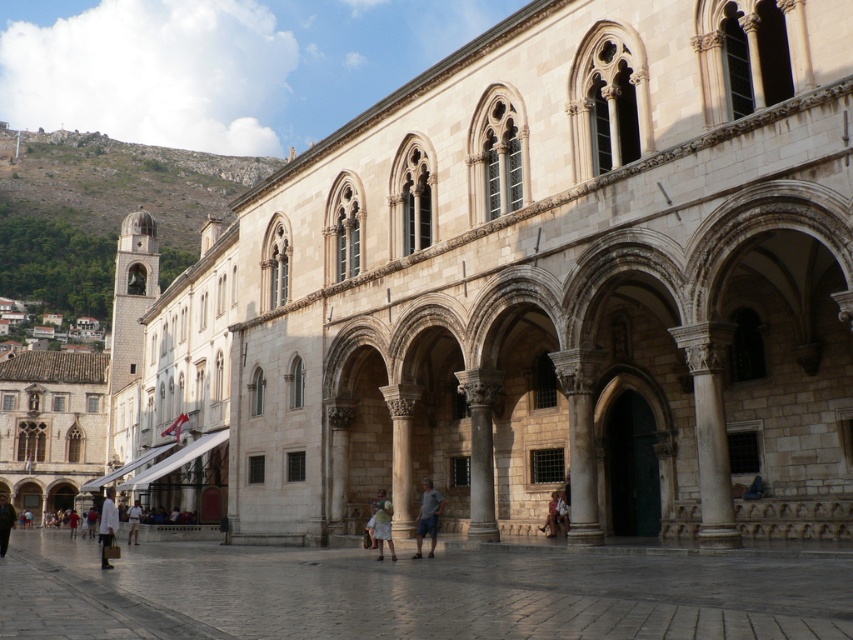
Which is in front, point (577, 486) or point (10, 520)?

Point (577, 486) is in front.

Between point (567, 401) and point (3, 540), which one is positioned in front?

Point (567, 401) is more forward.

Locate an element on the screen. This screenshot has width=853, height=640. white stone column at center is located at coordinates (579, 440).

Who is higher up, smooth stone column at center or light blue denim shorts at center?

Positioned higher is smooth stone column at center.

Between point (474, 499) and point (428, 532), which one is positioned in front?

Point (428, 532) is in front.

Locate an element on the screen. This screenshot has width=853, height=640. smooth stone column at center is located at coordinates (480, 449).

Where is `smooth stone column at center`? This screenshot has height=640, width=853. smooth stone column at center is located at coordinates click(x=480, y=449).

Does smooth stone courtyard at center have a greater width compared to light beige fabric bag at center?

Yes.

Who is taller, smooth stone courtyard at center or light beige fabric bag at center?

smooth stone courtyard at center is taller.

Is point (846, 618) positioned in front of point (374, 529)?

Yes, it is in front of point (374, 529).

Where is `smooth stone courtyard at center`? smooth stone courtyard at center is located at coordinates (413, 593).